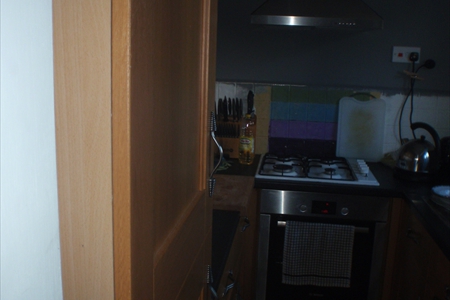
At what (x,y) coordinates should I click in order to perform the action: click on gas stove burner. Please return your answer as a coordinate pair (x, y). This screenshot has height=300, width=450. Looking at the image, I should click on (282, 167), (283, 159), (328, 160), (330, 171).